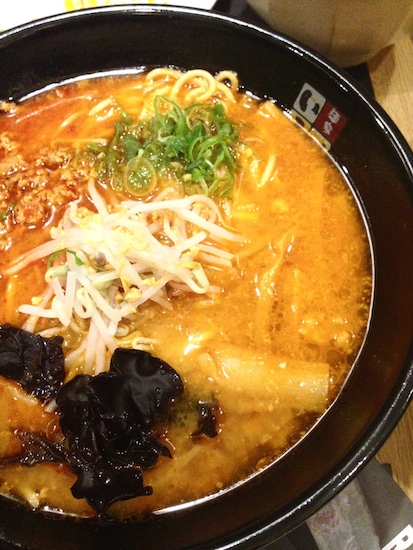
You are a GUI agent. You are given a task and a screenshot of the screen. Output one action in this format:
    pyautogui.click(x=<x>, y=<y>)
    Task: Click on the rim around black bowl
    The image size is (413, 550).
    Given the screenshot: What is the action you would take?
    pyautogui.click(x=273, y=532), pyautogui.click(x=364, y=455), pyautogui.click(x=402, y=403), pyautogui.click(x=53, y=20), pyautogui.click(x=247, y=26), pyautogui.click(x=380, y=116)